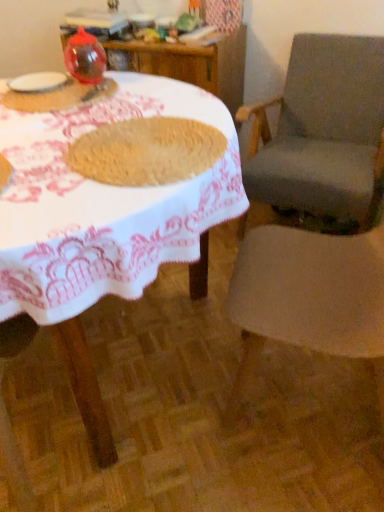
Where is `vacant region in front of white matte plate at upper left, which is the 2th tableware from top to bottom`? vacant region in front of white matte plate at upper left, which is the 2th tableware from top to bottom is located at coordinates (39, 103).